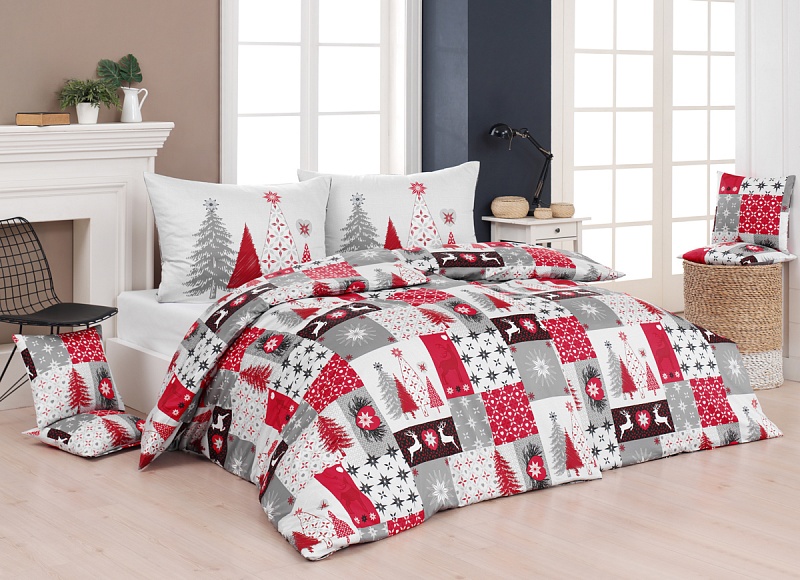
Locate an element on the screen. tan colored wall is located at coordinates (200, 72).